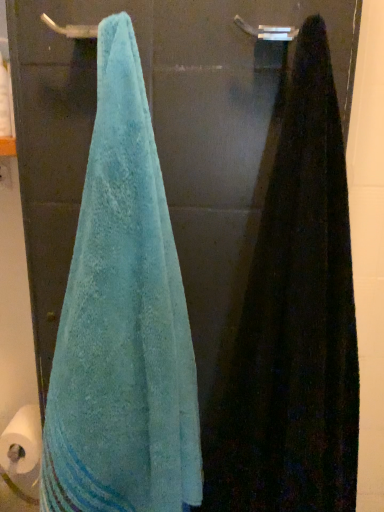
Question: Which is correct: silver metallic towel bar at upper center is inside black fuzzy towel at right, marked as the 1th towel in a right-to-left arrangement, or outside of it?

Choices:
 (A) outside
 (B) inside

Answer: (A)

Question: In terms of height, does silver metallic towel bar at upper center look taller or shorter compared to black fuzzy towel at right, the second towel viewed from the left?

Choices:
 (A) tall
 (B) short

Answer: (B)

Question: Estimate the real-world distances between objects in this image. Which object is farther from the black fuzzy towel at right, the second towel viewed from the left?

Choices:
 (A) teal terry cloth towel at left, the 2th towel positioned from the right
 (B) silver metallic towel bar at upper center

Answer: (B)

Question: Estimate the real-world distances between objects in this image. Which object is farther from the silver metallic towel bar at upper center?

Choices:
 (A) teal terry cloth towel at left, the 1th towel in the left-to-right sequence
 (B) black fuzzy towel at right, the second towel viewed from the left

Answer: (A)